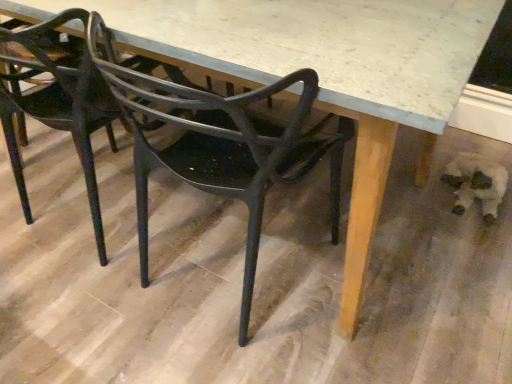
You are a GUI agent. You are given a task and a screenshot of the screen. Output one action in this format:
    pyautogui.click(x=<x>, y=<y>)
    Task: Click on the vacant space in fuzzy white dog at lower right (from a real-world perspective)
    The image size is (512, 384).
    Given the screenshot: What is the action you would take?
    coord(465,190)